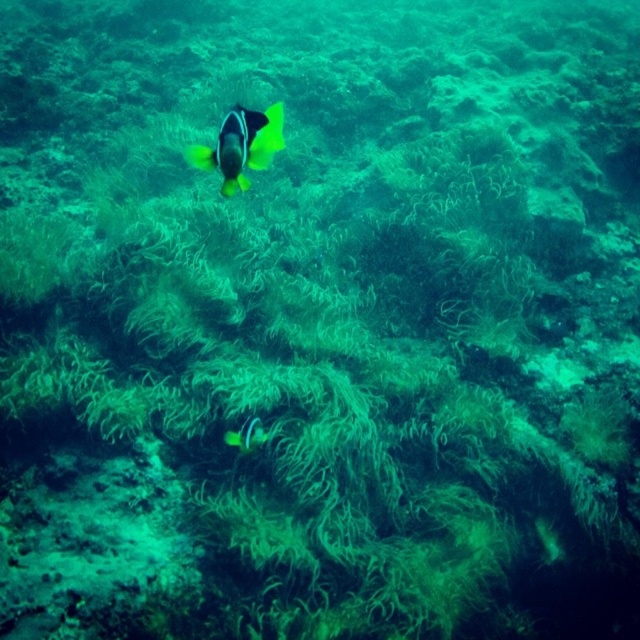
Can you confirm if yellow matte fish at center is positioned above bright yellow and black fish at center?

Yes.

At what (x,y) coordinates should I click in order to perform the action: click on yellow matte fish at center. Please return your answer as a coordinate pair (x, y). This screenshot has width=640, height=640. Looking at the image, I should click on (241, 145).

Is point (236, 131) positioned after point (243, 433)?

That is False.

This screenshot has width=640, height=640. What are the coordinates of `yellow matte fish at center` in the screenshot? It's located at 241,145.